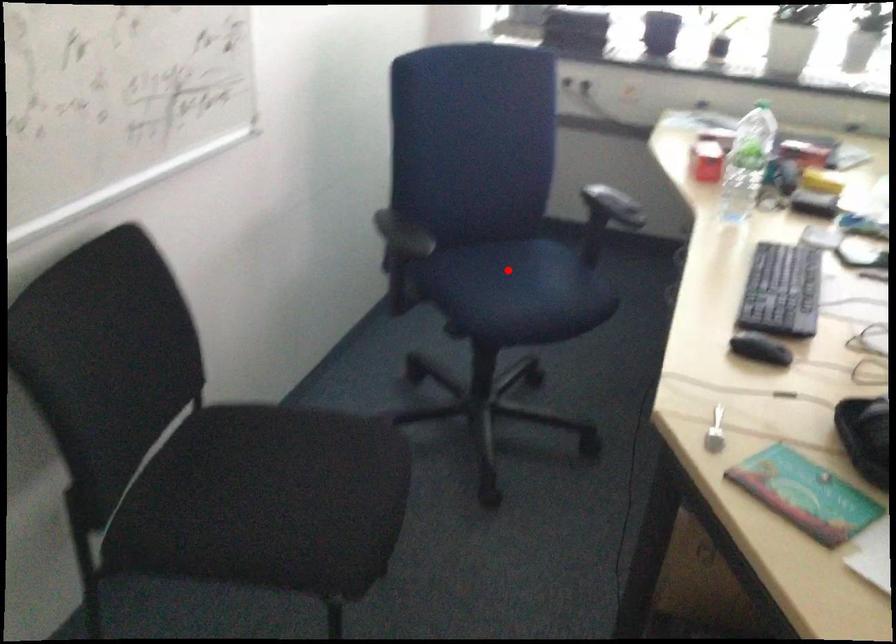
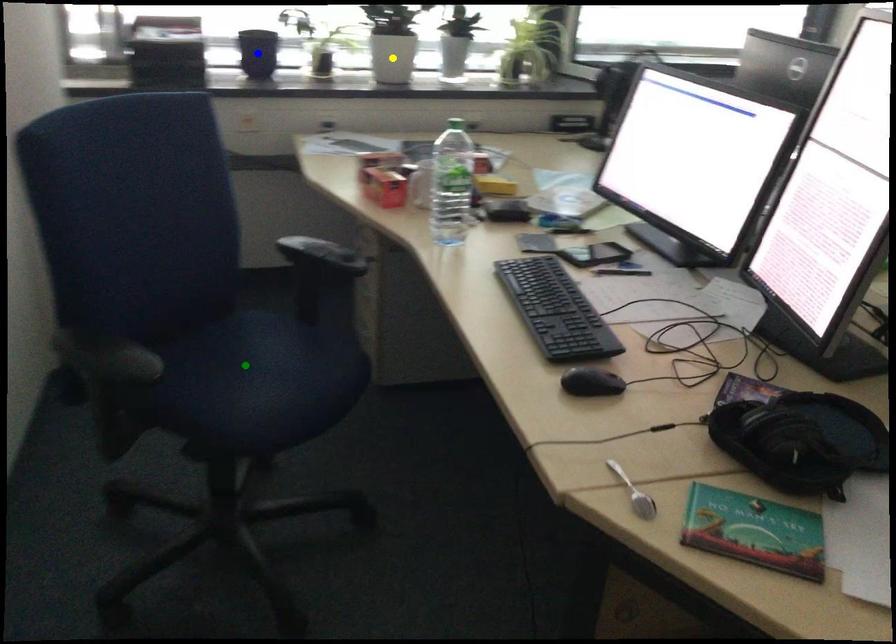
Question: I am providing you with two images of the same scene from different viewpoints. A red point is marked on the first image. You are given multiple points on the second image. Which point in image 2 represents the same 3d spot as the red point in image 1?

Choices:
 (A) blue point
 (B) yellow point
 (C) green point

Answer: (C)